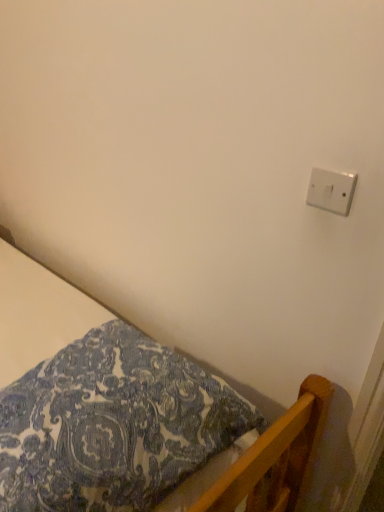
Identify the location of free spot above patterned fabric bed at lower left (from a real-world perspective). Image resolution: width=384 pixels, height=512 pixels. [89, 396].